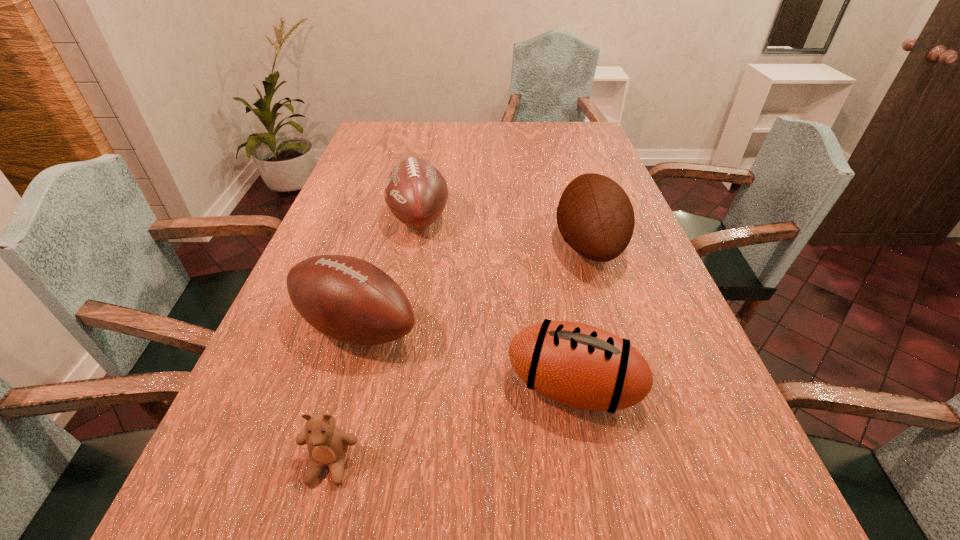
Find the location of `football (American) that is the third nearest to the teddy bear`. football (American) that is the third nearest to the teddy bear is located at coordinates (416, 192).

Point out which football (American) is positioned as the third nearest to the shortest football (American). Please provide its 2D coordinates. Your answer should be formatted as a tuple, i.e. [(x, y)], where the tuple contains the x and y coordinates of a point satisfying the conditions above.

[(416, 192)]